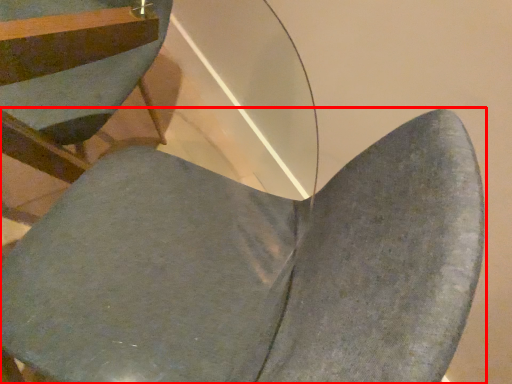
Question: From the image's perspective, where is chair (annotated by the red box) located relative to chair?

Choices:
 (A) below
 (B) above

Answer: (A)